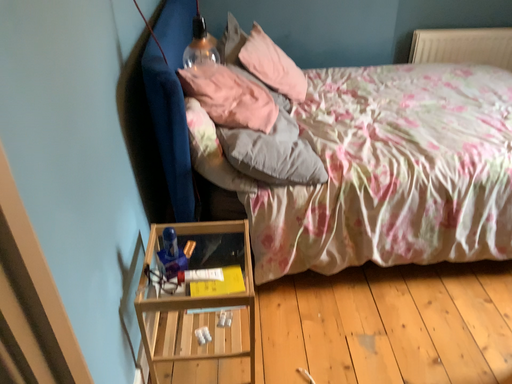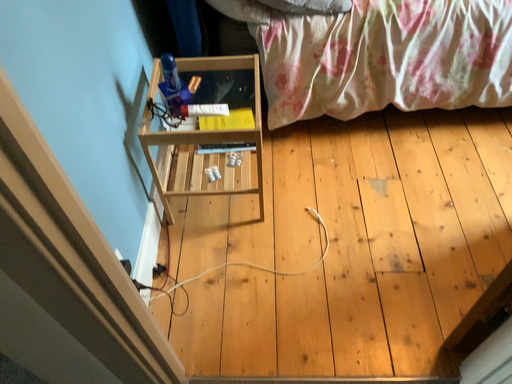
Question: How did the camera likely rotate when shooting the video?

Choices:
 (A) rotated downward
 (B) rotated upward

Answer: (A)